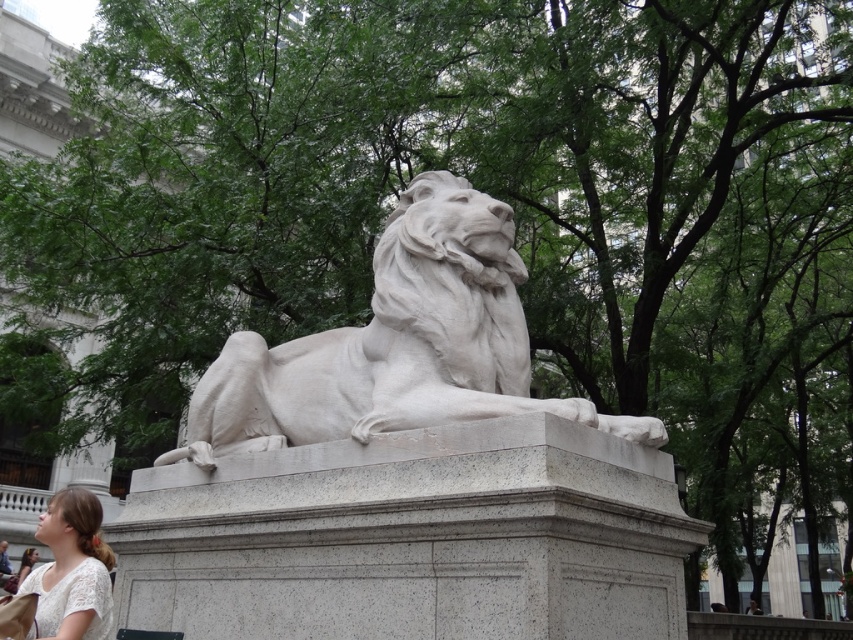
Question: Which point is farther to the camera?

Choices:
 (A) light brown hair at lower left
 (B) white lace shirt at lower left
 (C) white marble lion at center

Answer: (A)

Question: Which of the following is the farthest from the observer?

Choices:
 (A) light brown hair at lower left
 (B) white marble lion at center

Answer: (A)

Question: Where is white marble lion at center located in relation to light brown hair at lower left in the image?

Choices:
 (A) right
 (B) left

Answer: (A)

Question: Is white marble lion at center to the left of white lace shirt at lower left from the viewer's perspective?

Choices:
 (A) no
 (B) yes

Answer: (A)

Question: Estimate the real-world distances between objects in this image. Which object is farther from the light brown hair at lower left?

Choices:
 (A) white lace shirt at lower left
 (B) white marble lion at center

Answer: (B)

Question: Can you confirm if white marble lion at center is positioned to the right of white lace shirt at lower left?

Choices:
 (A) no
 (B) yes

Answer: (B)